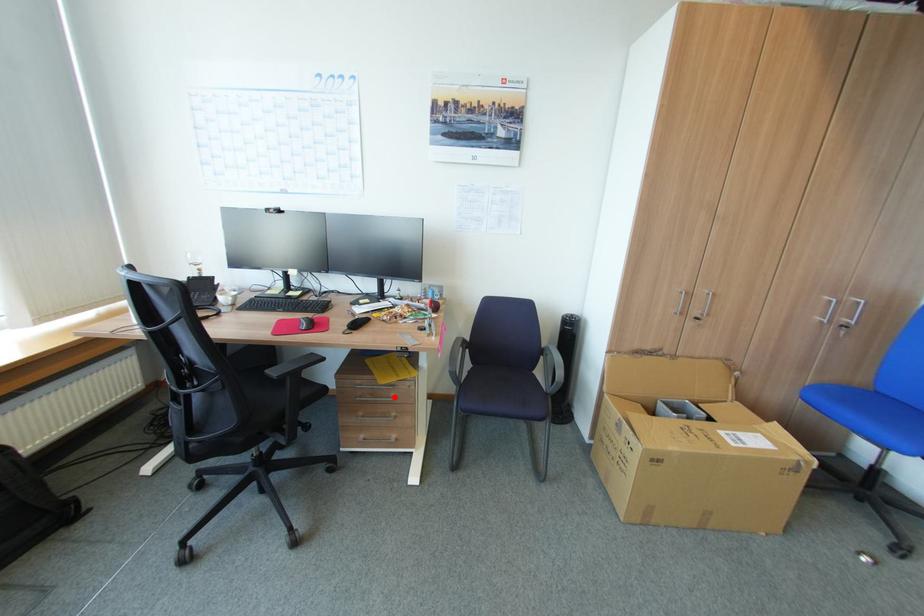
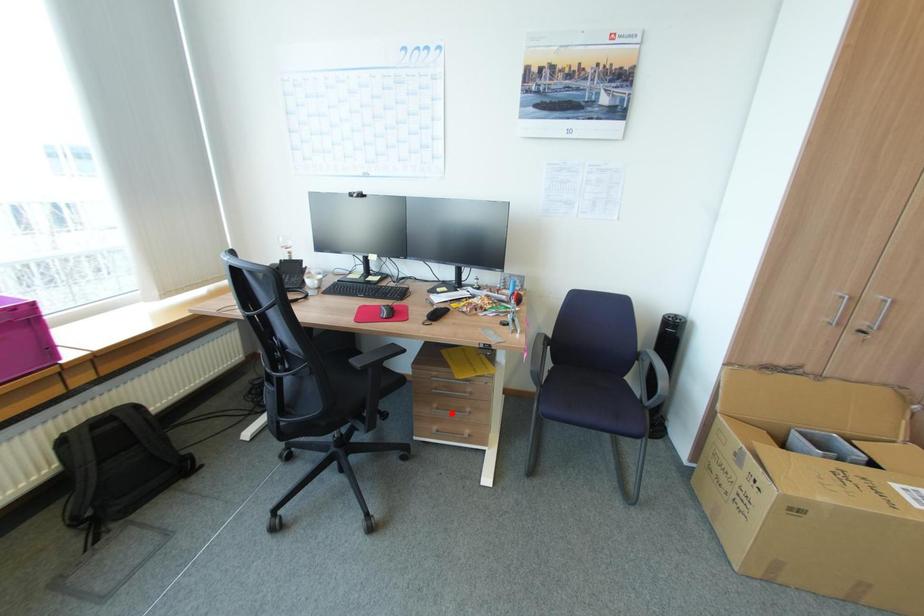
I am providing you with two images of the same scene from different viewpoints. A red point is marked on the first image and another point is marked on the second image. Does the point marked in image1 correspond to the same location as the one in image2?

No